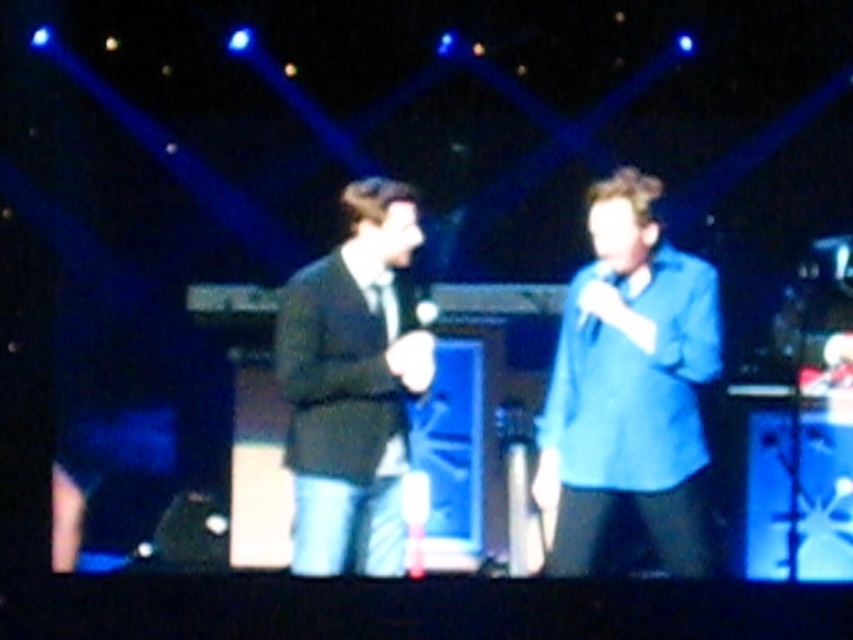
Which is more to the left, matte black suit at center or white matte microphone at center?

Positioned to the left is matte black suit at center.

Measure the distance between matte black suit at center and white matte microphone at center.

matte black suit at center is 4.28 feet from white matte microphone at center.

Between point (325, 262) and point (607, 269), which one is positioned in front?

Positioned in front is point (607, 269).

Locate an element on the screen. Image resolution: width=853 pixels, height=640 pixels. matte black suit at center is located at coordinates (352, 385).

Does blue matte shirt at center have a smaller size compared to white matte microphone at center?

Actually, blue matte shirt at center might be larger than white matte microphone at center.

Does point (688, 508) come in front of point (619, 276)?

Yes.

Describe the element at coordinates (631, 390) in the screenshot. I see `blue matte shirt at center` at that location.

At what (x,y) coordinates should I click in order to perform the action: click on blue matte shirt at center. Please return your answer as a coordinate pair (x, y). The width and height of the screenshot is (853, 640). Looking at the image, I should click on (631, 390).

Consider the image. Is blue matte shirt at center taller than matte black suit at center?

Correct, blue matte shirt at center is much taller as matte black suit at center.

Is point (665, 440) positioned after point (352, 508)?

No, it is in front of (352, 508).

Identify the location of blue matte shirt at center. The height and width of the screenshot is (640, 853). (631, 390).